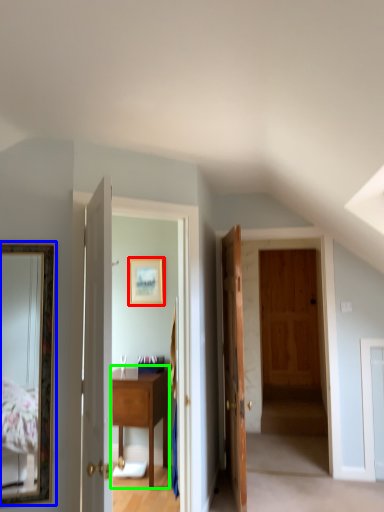
Question: Which object is positioned closest to picture frame (highlighted by a red box)? Select from mirror (highlighted by a blue box) and table (highlighted by a green box).

Choices:
 (A) mirror
 (B) table

Answer: (B)